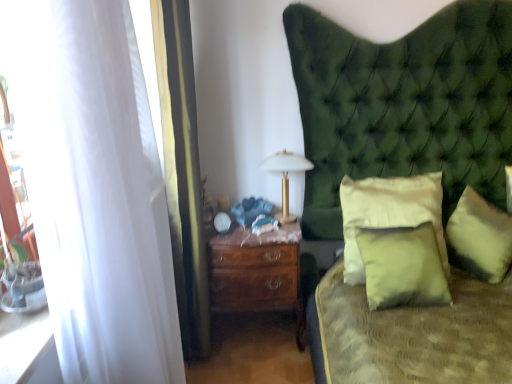
Question: Does soft cream pillow at center, placed as the 2th pillow when sorted from left to right, have a larger size compared to soft yellow fabric pillow at right, acting as the third pillow starting from the left?

Choices:
 (A) no
 (B) yes

Answer: (B)

Question: Considering the relative sizes of soft cream pillow at center, placed as the 2th pillow when sorted from left to right, and soft yellow fabric pillow at right, which is the 1th pillow in right-to-left order, in the image provided, is soft cream pillow at center, placed as the 2th pillow when sorted from left to right, smaller than soft yellow fabric pillow at right, which is the 1th pillow in right-to-left order,?

Choices:
 (A) yes
 (B) no

Answer: (B)

Question: From the image's perspective, is soft cream pillow at center, placed as the 2th pillow when sorted from left to right, over soft yellow fabric pillow at right, which is the 1th pillow in right-to-left order?

Choices:
 (A) no
 (B) yes

Answer: (B)

Question: From a real-world perspective, is soft cream pillow at center, placed as the 2th pillow when sorted from left to right, on soft yellow fabric pillow at right, which is the 1th pillow in right-to-left order?

Choices:
 (A) no
 (B) yes

Answer: (B)

Question: Would you say soft yellow fabric pillow at right, acting as the third pillow starting from the left, is part of soft cream pillow at center, which appears as the 2th pillow when viewed from the right,'s contents?

Choices:
 (A) yes
 (B) no

Answer: (B)

Question: From the image's perspective, is soft cream pillow at center, which appears as the 2th pillow when viewed from the right, located beneath soft yellow fabric pillow at right, acting as the third pillow starting from the left?

Choices:
 (A) yes
 (B) no

Answer: (B)

Question: Are soft yellow fabric pillow at right, which is the 1th pillow in right-to-left order, and matte green pillow at center, marked as the third pillow in a right-to-left arrangement, located far from each other?

Choices:
 (A) yes
 (B) no

Answer: (B)

Question: Does soft yellow fabric pillow at right, which is the 1th pillow in right-to-left order, lie in front of matte green pillow at center, marked as the third pillow in a right-to-left arrangement?

Choices:
 (A) no
 (B) yes

Answer: (A)

Question: From the image's perspective, is soft yellow fabric pillow at right, which is the 1th pillow in right-to-left order, beneath matte green pillow at center, marked as the third pillow in a right-to-left arrangement?

Choices:
 (A) no
 (B) yes

Answer: (A)

Question: From the image's perspective, would you say soft yellow fabric pillow at right, which is the 1th pillow in right-to-left order, is positioned over matte green pillow at center, the 1th pillow from the left?

Choices:
 (A) no
 (B) yes

Answer: (B)

Question: Is soft yellow fabric pillow at right, acting as the third pillow starting from the left, not inside matte green pillow at center, the 1th pillow from the left?

Choices:
 (A) no
 (B) yes

Answer: (B)

Question: Is soft yellow fabric pillow at right, acting as the third pillow starting from the left, smaller than matte green pillow at center, the 1th pillow from the left?

Choices:
 (A) yes
 (B) no

Answer: (B)

Question: From the image's perspective, would you say matte green pillow at center, the 1th pillow from the left, is positioned over gold metallic bedside lamp at center?

Choices:
 (A) yes
 (B) no

Answer: (B)